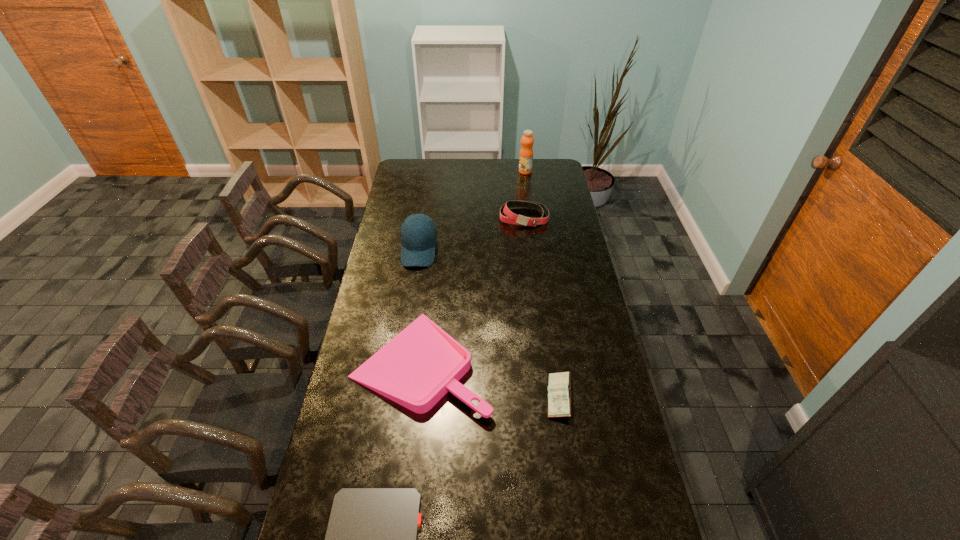
The height and width of the screenshot is (540, 960). Identify the location of vacant space at the far left corner of the desktop. (404, 165).

Find the location of `empty space that is in between the diary and the second farthest object`. empty space that is in between the diary and the second farthest object is located at coordinates (541, 307).

Find the location of `vacant space that's between the dustpan and the fifth shortest object`. vacant space that's between the dustpan and the fifth shortest object is located at coordinates (420, 307).

This screenshot has height=540, width=960. Find the location of `free space between the fifth nearest object and the farthest object`. free space between the fifth nearest object and the farthest object is located at coordinates (524, 194).

Locate an element on the screen. The width and height of the screenshot is (960, 540). vacant area that lies between the dog collar and the baseball cap is located at coordinates (471, 234).

Locate an element on the screen. This screenshot has height=540, width=960. empty space that is in between the dustpan and the fruit juice is located at coordinates (473, 267).

At what (x,y) coordinates should I click in order to perform the action: click on free spot between the diary and the dog collar. Please return your answer as a coordinate pair (x, y). Looking at the image, I should click on 541,307.

Locate an element on the screen. Image resolution: width=960 pixels, height=540 pixels. free spot between the tallest object and the second tallest object is located at coordinates (472, 211).

This screenshot has height=540, width=960. Identify the location of object that is the third closest one to the dustpan. (418, 232).

Choose which object is the third nearest neighbor to the dustpan. Please provide its 2D coordinates. Your answer should be formatted as a tuple, i.e. [(x, y)], where the tuple contains the x and y coordinates of a point satisfying the conditions above.

[(418, 232)]